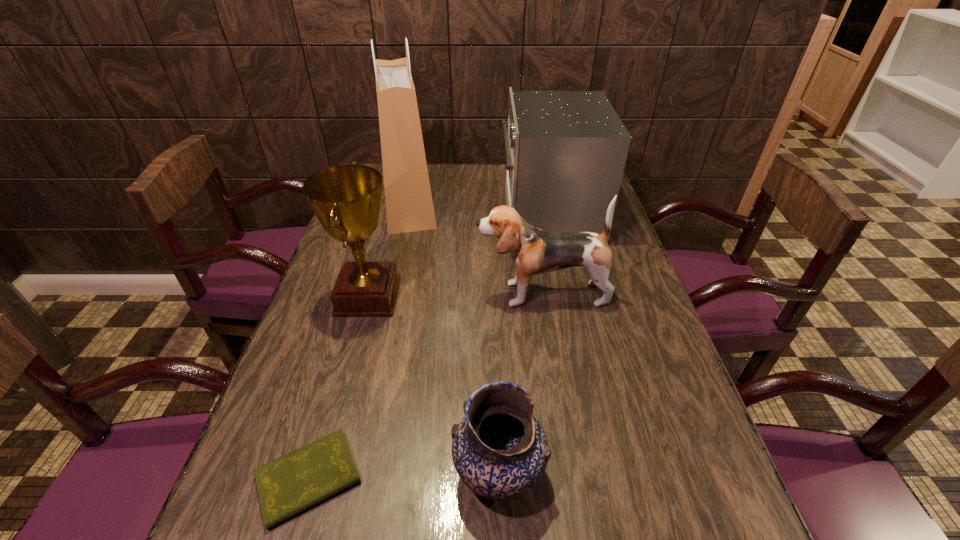
You are a GUI agent. You are given a task and a screenshot of the screen. Output one action in this format:
    pyautogui.click(x=<x>, y=<y>)
    Task: Click on the empty space that is in between the award and the second shortest object
    
    Given the screenshot: What is the action you would take?
    pyautogui.click(x=433, y=386)

Where is `free area in between the fifth tallest object and the tallest object`? free area in between the fifth tallest object and the tallest object is located at coordinates (453, 339).

I want to click on empty space that is in between the puppy and the tallest object, so click(x=475, y=248).

Locate an element on the screen. This screenshot has width=960, height=540. free spot between the shortest object and the pottery is located at coordinates coord(404,477).

Locate an element on the screen. The height and width of the screenshot is (540, 960). free space between the shortest object and the toaster oven is located at coordinates (429, 347).

Where is `vacant space that's between the shopping bag and the award`? Image resolution: width=960 pixels, height=540 pixels. vacant space that's between the shopping bag and the award is located at coordinates (388, 249).

Where is `vacant space that is in between the puppy and the pottery`? This screenshot has width=960, height=540. vacant space that is in between the puppy and the pottery is located at coordinates (520, 384).

Identify the location of the closest object relative to the toaster oven. click(x=533, y=251).

Identify which object is the nearest to the shopping bag. Please provide its 2D coordinates. Your answer should be formatted as a tuple, i.e. [(x, y)], where the tuple contains the x and y coordinates of a point satisfying the conditions above.

[(346, 199)]

Find the location of a particular element. The width and height of the screenshot is (960, 540). vacant area in the image that satisfies the following two spatial constraints: 1. on the front panel of the toaster oven; 2. on the front side of the second shortest object is located at coordinates (604, 474).